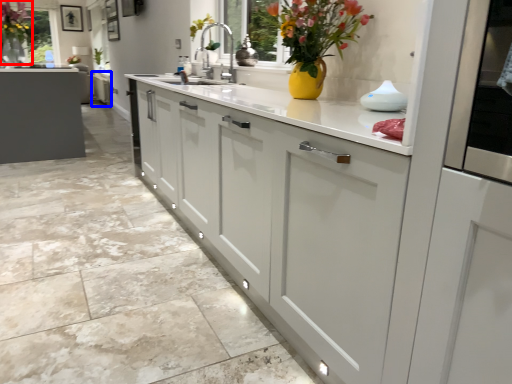
Question: Which object is closer to the camera taking this photo, floral arrangement (highlighted by a red box) or cabinetry (highlighted by a blue box)?

Choices:
 (A) floral arrangement
 (B) cabinetry

Answer: (A)